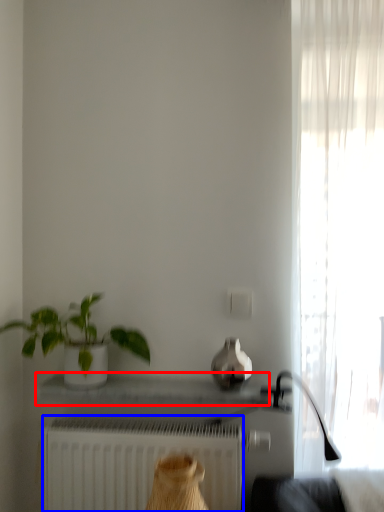
Question: Which of the following is the farthest to the observer, window sill (highlighted by a red box) or radiator (highlighted by a blue box)?

Choices:
 (A) window sill
 (B) radiator

Answer: (B)